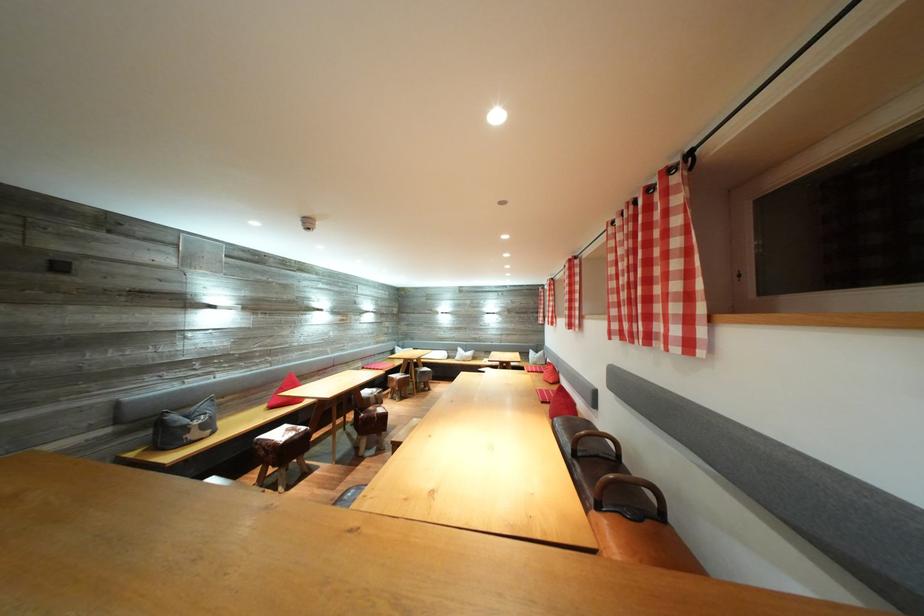
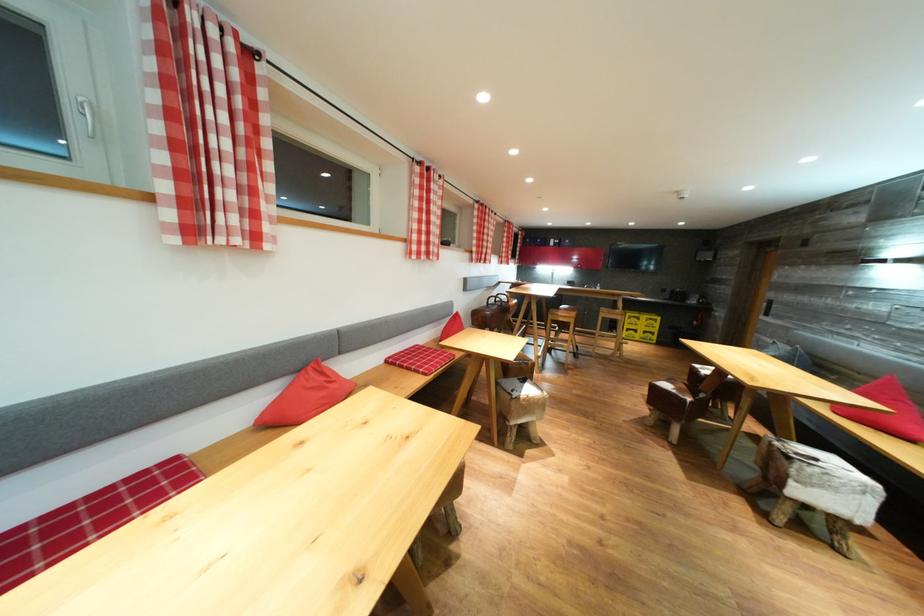
Question: I am providing you with two images of the same scene from different viewpoints. After the viewpoint changes to image2, which objects are now occluded?

Choices:
 (A) yellow cardboard box
 (B) chair sitting surface
 (C) shovel
 (D) brown leather handle

Answer: (B)